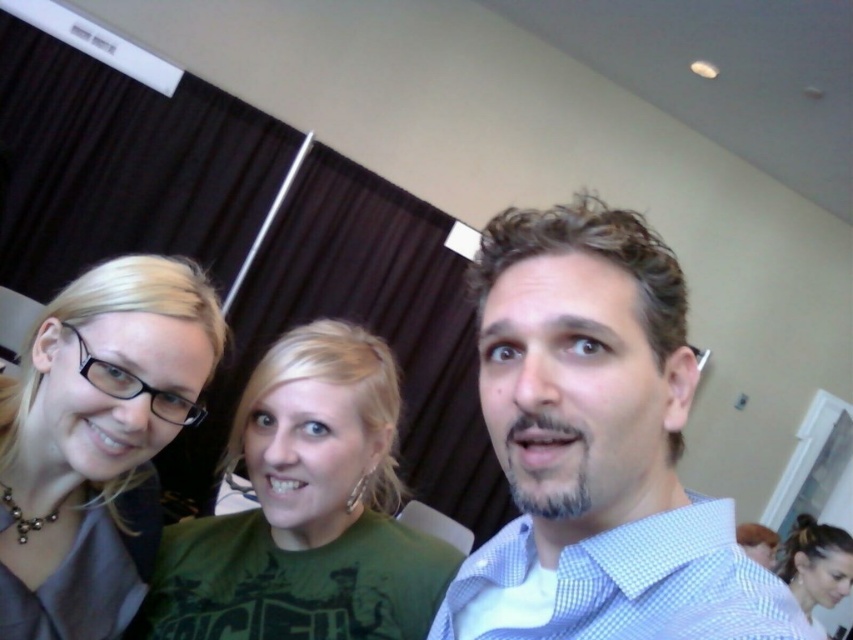
This screenshot has height=640, width=853. Describe the element at coordinates (96, 442) in the screenshot. I see `matte black glasses at left` at that location.

Where is `matte black glasses at left`? matte black glasses at left is located at coordinates (96, 442).

Who is positioned more to the right, light blue checkered shirt at center or matte black glasses at left?

light blue checkered shirt at center is more to the right.

From the picture: Does light blue checkered shirt at center lie in front of matte black glasses at left?

Yes, it is.

Identify the location of light blue checkered shirt at center. The image size is (853, 640). coord(596,448).

How far apart are green fabric shirt at center and dark brown hair at lower right?

green fabric shirt at center is 2.72 meters away from dark brown hair at lower right.

At what (x,y) coordinates should I click in order to perform the action: click on green fabric shirt at center. Please return your answer as a coordinate pair (x, y). The height and width of the screenshot is (640, 853). Looking at the image, I should click on (305, 509).

Between point (366, 342) and point (836, 557), which one is positioned in front?

Point (366, 342) is in front.

Identify the location of green fabric shirt at center. This screenshot has width=853, height=640. (305, 509).